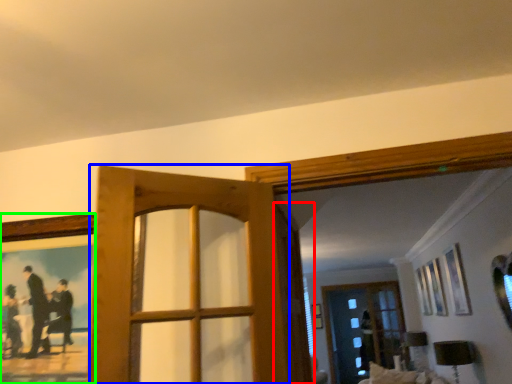
Question: Estimate the real-world distances between objects in this image. Which object is closer to screen door (highlighted by a red box), door (highlighted by a blue box) or picture frame (highlighted by a green box)?

Choices:
 (A) door
 (B) picture frame

Answer: (A)